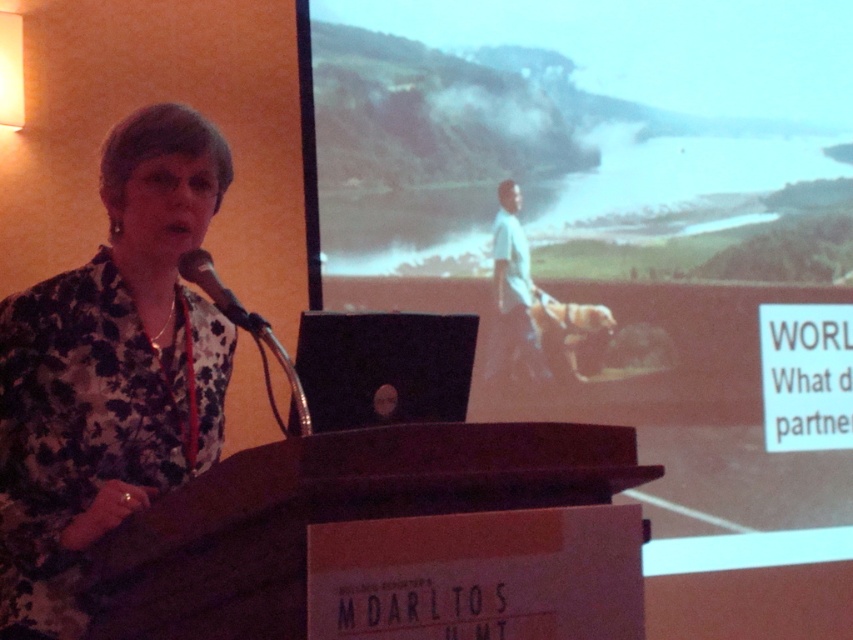
You are organizing a photo shoot and need to ensure that the floral fabric shirt at left and the black matte laptop at center are both visible in the frame. Given their sizes, which object should you prioritize keeping in focus to ensure it doesn t get lost in the background?

The black matte laptop at center is smaller than the floral fabric shirt at left, so you should prioritize keeping the black matte laptop at center in focus to prevent it from becoming too small and indistinct in the photo.

You are a photographer at the event and need to adjust the lighting so that the floral fabric shirt at left and the black matte laptop at center are both clearly visible. Which object should you focus on first to ensure proper exposure, considering their sizes?

The floral fabric shirt at left is taller than the black matte laptop at center, so focusing on the larger object first will help balance the exposure for both.

You are an event technician who needs to adjust the microphone stand so that the matte black microphone at left is at the same height as the matte black laptop at center. Based on the scene description, is this adjustment necessary? Why?

The matte black laptop at center is much taller than the matte black microphone at left, so adjusting the microphone stand to match the laptop height would be necessary to ensure proper alignment.